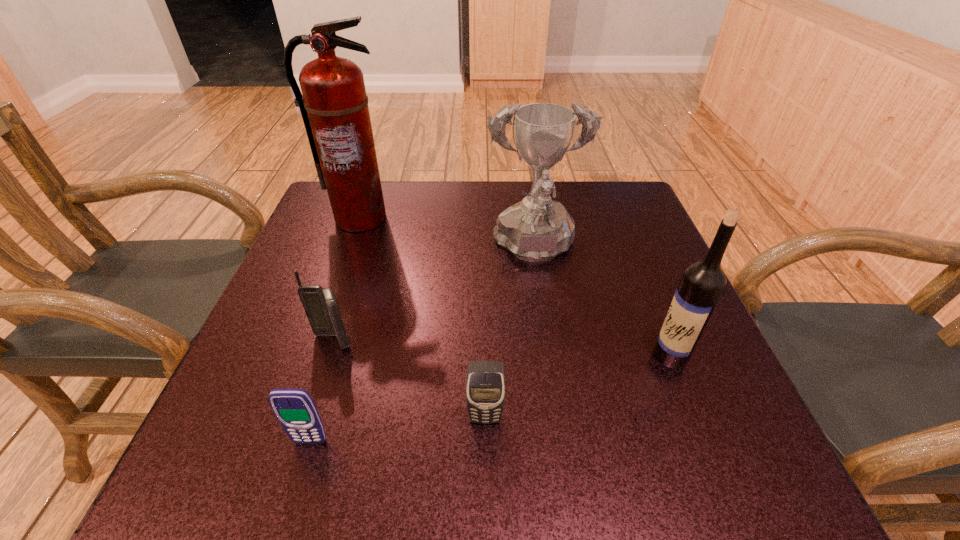
This screenshot has height=540, width=960. Identify the location of the tallest object. (334, 107).

This screenshot has height=540, width=960. Identify the location of award. (535, 229).

Locate an element on the screen. The height and width of the screenshot is (540, 960). wine bottle is located at coordinates (703, 282).

Identify the location of the farthest cellular telephone. (320, 305).

This screenshot has height=540, width=960. In order to click on the fifth farthest object in this screenshot , I will do `click(485, 381)`.

This screenshot has width=960, height=540. Identify the location of the second nearest cellular telephone. (485, 381).

Image resolution: width=960 pixels, height=540 pixels. I want to click on the nearest object, so pyautogui.click(x=294, y=408).

Image resolution: width=960 pixels, height=540 pixels. Find the location of `free location located 0.280m on the side of the fire extinguisher with the handle and hose`. free location located 0.280m on the side of the fire extinguisher with the handle and hose is located at coordinates click(324, 319).

Where is `free space located on the side with emblem of the award`? free space located on the side with emblem of the award is located at coordinates 557,408.

You are a GUI agent. You are given a task and a screenshot of the screen. Output one action in this format:
    pyautogui.click(x=<x>, y=<y>)
    Task: Click on the free space located on the label of the rightmost object
    The width and height of the screenshot is (960, 540).
    Given the screenshot: What is the action you would take?
    pyautogui.click(x=554, y=355)